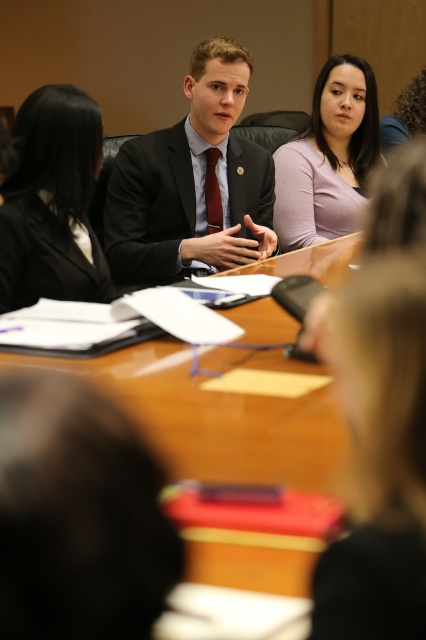
You are sitting at the conference table and notice two items in the scene. Which one is closer to you between the blonde hair at lower right and the matte purple shirt at center?

The blonde hair at lower right is closer to you because it is in front of the matte purple shirt at center.